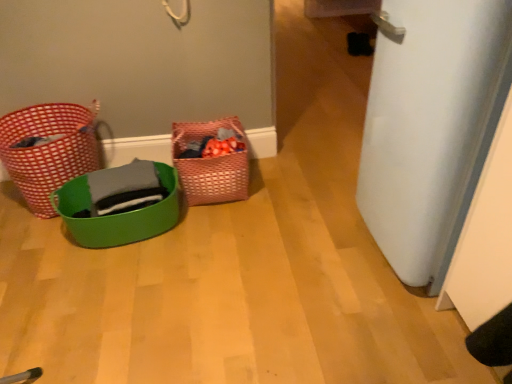
You are a GUI agent. You are given a task and a screenshot of the screen. Output one action in this format:
    pyautogui.click(x=<x>, y=<y>)
    Task: Click on the free space in front of green plastic basket at lower left, marked as the second basket in a right-to-left arrangement
    The height and width of the screenshot is (384, 512).
    Given the screenshot: What is the action you would take?
    pyautogui.click(x=105, y=299)